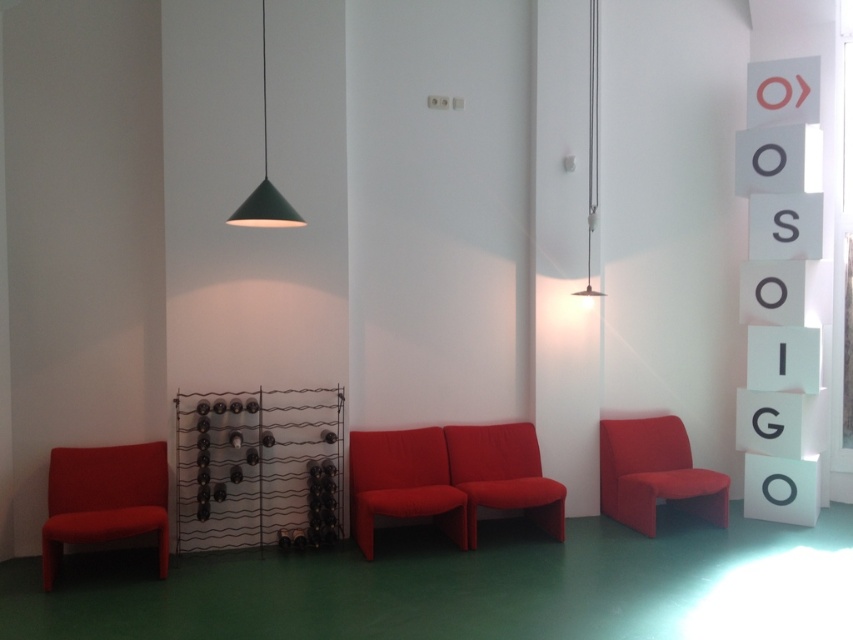
Is matte red armchair at left behind matte red armchair at right?

No.

Does matte red armchair at left appear over matte red armchair at right?

Incorrect, matte red armchair at left is not positioned above matte red armchair at right.

Is point (50, 580) farther from camera compared to point (601, 442)?

No, it is in front of (601, 442).

Locate an element on the screen. matte red armchair at left is located at coordinates (103, 499).

Is matte red armchair at right bigger than matte red sofa at center?

Indeed, matte red armchair at right has a larger size compared to matte red sofa at center.

The height and width of the screenshot is (640, 853). Describe the element at coordinates (654, 474) in the screenshot. I see `matte red armchair at right` at that location.

Locate an element on the screen. The image size is (853, 640). matte red armchair at right is located at coordinates (654, 474).

This screenshot has height=640, width=853. I want to click on matte red armchair at left, so click(103, 499).

Who is lower down, matte red armchair at left or green matte pendant light at upper center?

Positioned lower is matte red armchair at left.

Locate an element on the screen. This screenshot has width=853, height=640. matte red armchair at left is located at coordinates (103, 499).